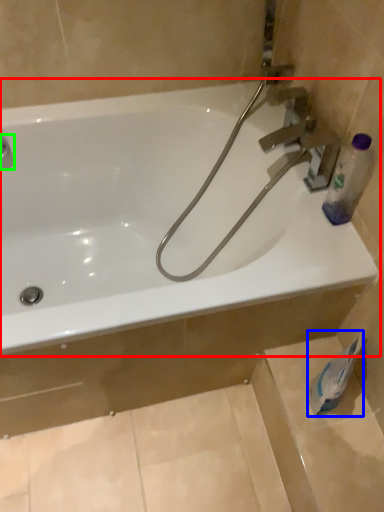
Question: Based on their relative distances, which object is nearer to bathtub (highlighted by a red box)? Choose from toilet paper (highlighted by a blue box) and plumbing fixture (highlighted by a green box).

Choices:
 (A) toilet paper
 (B) plumbing fixture

Answer: (B)